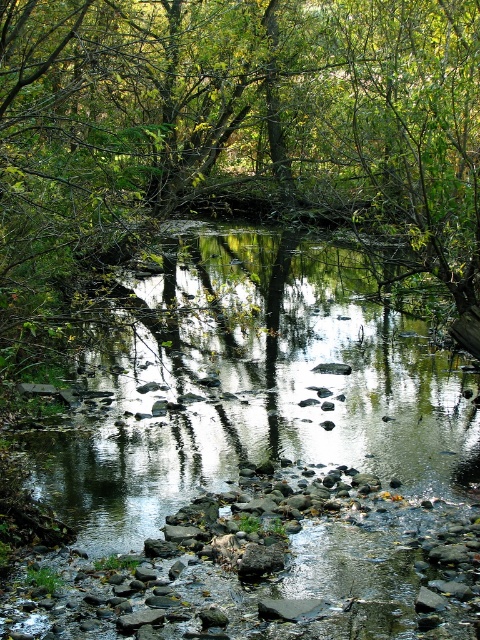
Question: Does green leafy tree at center appear on the left side of gray smooth rock at center?

Choices:
 (A) no
 (B) yes

Answer: (A)

Question: Which object appears closest to the camera in this image?

Choices:
 (A) green leafy tree at center
 (B) gray smooth rock at center

Answer: (A)

Question: Is green leafy tree at center positioned behind gray smooth rock at center?

Choices:
 (A) yes
 (B) no

Answer: (B)

Question: Considering the relative positions of green leafy tree at center and gray smooth rock at center in the image provided, where is green leafy tree at center located with respect to gray smooth rock at center?

Choices:
 (A) right
 (B) left

Answer: (A)